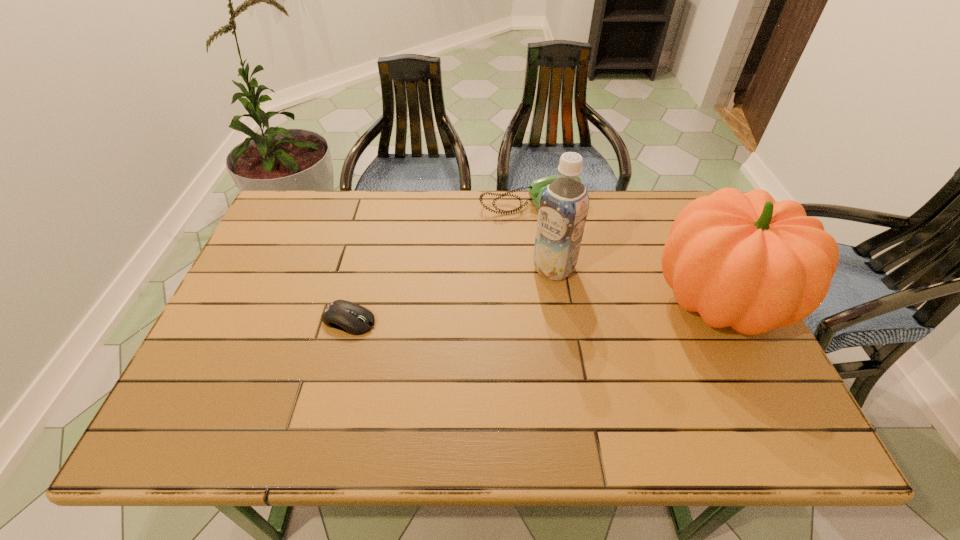
You are a GUI agent. You are given a task and a screenshot of the screen. Output one action in this format:
    pyautogui.click(x=<x>, y=<y>)
    Task: Click on the free region at the near left corner of the desktop
    The image size is (960, 540).
    Given the screenshot: What is the action you would take?
    pyautogui.click(x=197, y=395)

At what (x,y) coordinates should I click in order to perform the action: click on free location at the near right corner of the desktop. Please return your answer as a coordinate pair (x, y). Looking at the image, I should click on (716, 388).

This screenshot has width=960, height=540. What are the coordinates of `vacant point located between the leftmost object and the farthest object` in the screenshot? It's located at (440, 262).

In order to click on vacant region between the pumpkin and the shortest object in this screenshot , I will do `click(534, 310)`.

Locate an element on the screen. The image size is (960, 540). free spot between the pumpkin and the shortest object is located at coordinates (534, 310).

Where is `empty space between the shortest object and the soya milk`? empty space between the shortest object and the soya milk is located at coordinates (451, 294).

Locate an element on the screen. vacant area between the second shortest object and the shortest object is located at coordinates (440, 262).

Locate an element on the screen. This screenshot has height=540, width=960. vacant point located between the shortest object and the pumpkin is located at coordinates (534, 310).

Locate an element on the screen. empty space between the rightmost object and the telephone is located at coordinates (625, 253).

Identify the location of free space between the shortest object and the telephone. (440, 262).